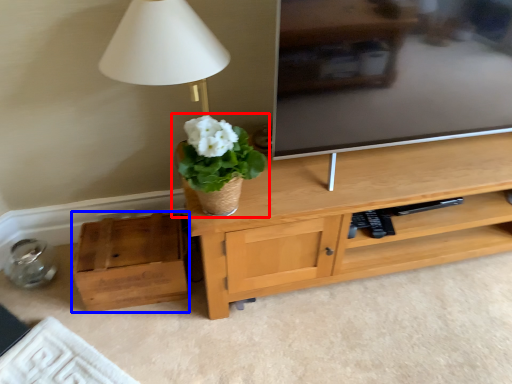
Question: Which object is closer to the camera taking this photo, houseplant (highlighted by a red box) or box (highlighted by a blue box)?

Choices:
 (A) houseplant
 (B) box

Answer: (A)